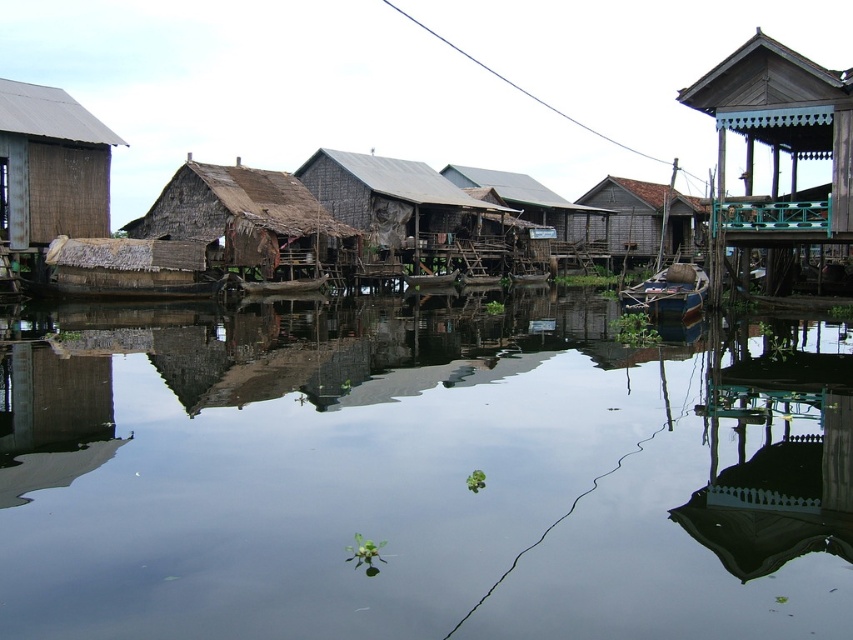
Question: Does wooden porch at upper right have a greater width compared to brown wooden hut at center?

Choices:
 (A) no
 (B) yes

Answer: (A)

Question: Which object is positioned farthest from the brown corrugated metal hut at left?

Choices:
 (A) wooden hut at center
 (B) thatched brown hut at center
 (C) wooden boat at center
 (D) brown wooden hut at center

Answer: (D)

Question: Does rustic wooden houses at center appear under brown corrugated metal hut at left?

Choices:
 (A) no
 (B) yes

Answer: (A)

Question: Which object appears closest to the camera in this image?

Choices:
 (A) brown corrugated metal hut at left
 (B) wooden hut at center
 (C) thatched brown hut at center
 (D) wooden boat at center

Answer: (D)

Question: Which point appears farthest from the camera in this image?

Choices:
 (A) (15, 104)
 (B) (509, 189)

Answer: (B)

Question: Is dark brown wooden hut at center further to the viewer compared to brown wooden hut at center?

Choices:
 (A) no
 (B) yes

Answer: (A)